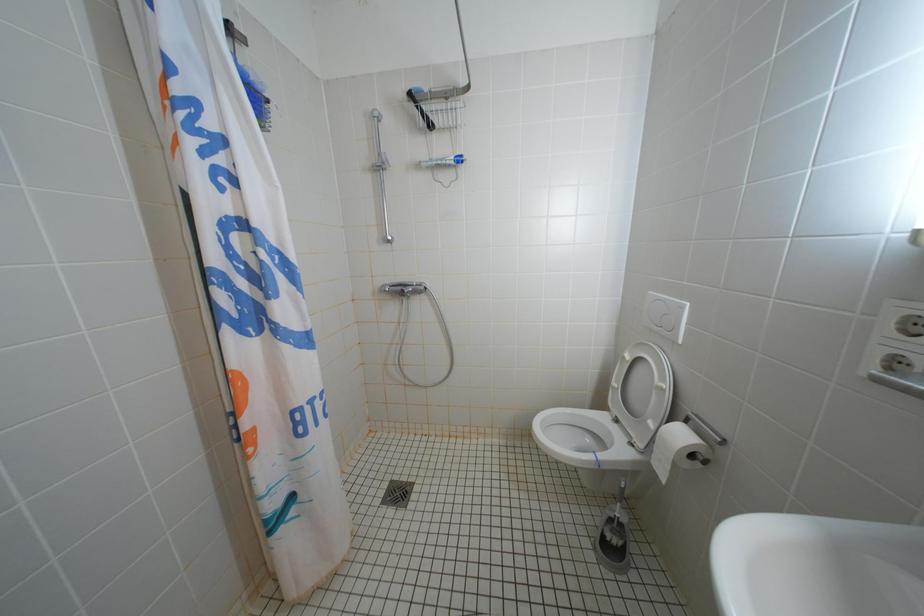
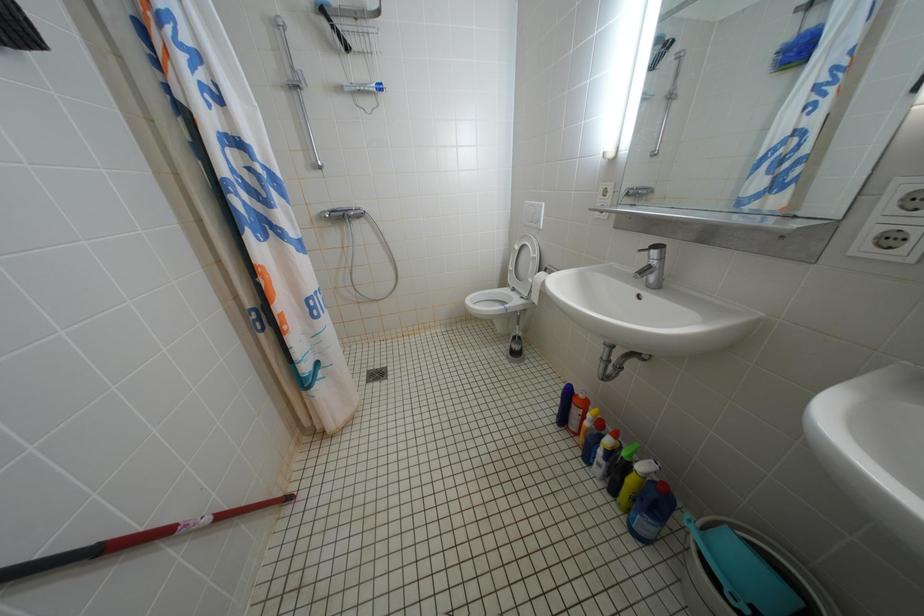
Question: Based on the continuous images, in which direction is the camera rotating? Reply with the corresponding letter.

Choices:
 (A) Left
 (B) Right
 (C) Up
 (D) Down

Answer: (B)